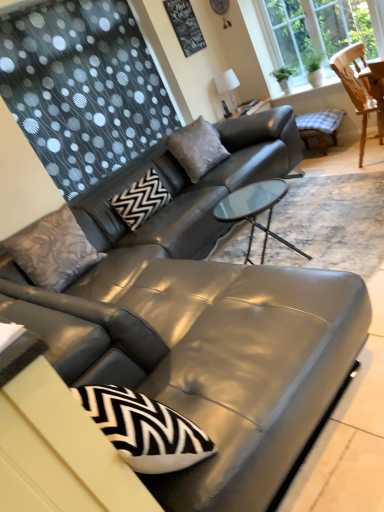
Image resolution: width=384 pixels, height=512 pixels. Describe the element at coordinates (53, 250) in the screenshot. I see `textured gray pillow at left, which is the 3th pillow from right to left` at that location.

What is the approximate width of wooden chair at upper right?

19.75 inches.

This screenshot has height=512, width=384. I want to click on white glass lampshade at upper right, so click(228, 85).

Can transparent glass window at upper right be found inside black zigzag-patterned pillow at center, which appears as the 2th pillow when viewed from the right?

Actually, transparent glass window at upper right is outside black zigzag-patterned pillow at center, which appears as the 2th pillow when viewed from the right.

How many degrees apart are the facing directions of black zigzag-patterned pillow at center, which appears as the 2th pillow when viewed from the right, and transparent glass window at upper right?

They differ by 91.1 degrees in their facing directions.

Can you confirm if black zigzag-patterned pillow at center, which appears as the 2th pillow when viewed from the right, is bigger than transparent glass window at upper right?

No, black zigzag-patterned pillow at center, which appears as the 2th pillow when viewed from the right, is not bigger than transparent glass window at upper right.

From a real-world perspective, relative to transparent glass window at upper right, is black zigzag-patterned pillow at center, the second pillow from the left, vertically above or below?

black zigzag-patterned pillow at center, the second pillow from the left, is below transparent glass window at upper right.

Is black zigzag-patterned pillow at center, the second pillow from the left, a part of textured gray pillow at left, which is the 3th pillow from right to left?

No, black zigzag-patterned pillow at center, the second pillow from the left, is not surrounded by textured gray pillow at left, which is the 3th pillow from right to left.

In the scene shown: Can you confirm if textured gray pillow at left, which is the 3th pillow from right to left, is positioned to the left of black zigzag-patterned pillow at center, which appears as the 2th pillow when viewed from the right?

Correct, you'll find textured gray pillow at left, which is the 3th pillow from right to left, to the left of black zigzag-patterned pillow at center, which appears as the 2th pillow when viewed from the right.

From the image's perspective, who appears lower, textured gray pillow at left, which is the 3th pillow from right to left, or black zigzag-patterned pillow at center, the second pillow from the left?

textured gray pillow at left, which is the 3th pillow from right to left, is shown below in the image.

From a real-world perspective, which object rests below the other?

In real-world perspective, black zigzag-patterned pillow at center, the second pillow from the left, is lower.

Is matte gray cushion at center, which is the third pillow in left-to-right order, beside black zigzag-patterned pillow at center, which appears as the 2th pillow when viewed from the right?

No.

Does matte gray cushion at center, which is the third pillow in left-to-right order, have a larger size compared to black zigzag-patterned pillow at center, which appears as the 2th pillow when viewed from the right?

Indeed, matte gray cushion at center, which is the third pillow in left-to-right order, has a larger size compared to black zigzag-patterned pillow at center, which appears as the 2th pillow when viewed from the right.

Based on the photo, could you tell me if black textured board at upper center is turned towards textured gray pillow at left, the 1th pillow from the left?

No, black textured board at upper center is not oriented towards textured gray pillow at left, the 1th pillow from the left.

Considering the points (188, 22) and (11, 244), which point is in front, point (188, 22) or point (11, 244)?

The point (11, 244) is closer to the camera.

Would you say black textured board at upper center is outside textured gray pillow at left, the 1th pillow from the left?

Absolutely, black textured board at upper center is external to textured gray pillow at left, the 1th pillow from the left.

Can you confirm if black textured board at upper center is wider than matte gray cushion at center, which is the third pillow in left-to-right order?

Incorrect, the width of black textured board at upper center does not surpass that of matte gray cushion at center, which is the third pillow in left-to-right order.

Are black textured board at upper center and matte gray cushion at center, acting as the first pillow starting from the right, located far from each other?

black textured board at upper center is far away from matte gray cushion at center, acting as the first pillow starting from the right.

Which is more to the right, black textured board at upper center or matte gray cushion at center, which is the third pillow in left-to-right order?

From the viewer's perspective, matte gray cushion at center, which is the third pillow in left-to-right order, appears more on the right side.

From the image's perspective, is black textured board at upper center located beneath matte gray cushion at center, which is the third pillow in left-to-right order?

Incorrect, from the image's perspective, black textured board at upper center is higher than matte gray cushion at center, which is the third pillow in left-to-right order.

Is black zigzag-patterned pillow at center, the second pillow from the left, looking in the opposite direction of textured gray pillow at left, which is the 3th pillow from right to left?

No, black zigzag-patterned pillow at center, the second pillow from the left, is not facing away from textured gray pillow at left, which is the 3th pillow from right to left.

Is black zigzag-patterned pillow at center, the second pillow from the left, taller or shorter than textured gray pillow at left, the 1th pillow from the left?

black zigzag-patterned pillow at center, the second pillow from the left, is shorter than textured gray pillow at left, the 1th pillow from the left.

Considering the relative sizes of black zigzag-patterned pillow at center, which appears as the 2th pillow when viewed from the right, and textured gray pillow at left, the 1th pillow from the left, in the image provided, is black zigzag-patterned pillow at center, which appears as the 2th pillow when viewed from the right, wider than textured gray pillow at left, the 1th pillow from the left,?

Yes, black zigzag-patterned pillow at center, which appears as the 2th pillow when viewed from the right, is wider than textured gray pillow at left, the 1th pillow from the left.

Is black zigzag-patterned pillow at center, the second pillow from the left, in contact with textured gray pillow at left, which is the 3th pillow from right to left?

No, black zigzag-patterned pillow at center, the second pillow from the left, is not making contact with textured gray pillow at left, which is the 3th pillow from right to left.

Locate an element on the screen. Image resolution: width=384 pixels, height=512 pixels. bulletin board behind the matte gray cushion at center, acting as the first pillow starting from the right is located at coordinates (185, 26).

Which is correct: matte gray cushion at center, which is the third pillow in left-to-right order, is inside black textured board at upper center, or outside of it?

matte gray cushion at center, which is the third pillow in left-to-right order, is not enclosed by black textured board at upper center.

Considering the points (218, 158) and (171, 21), which point is behind, point (218, 158) or point (171, 21)?

Point (171, 21)

Considering the sizes of matte gray cushion at center, which is the third pillow in left-to-right order, and black textured board at upper center in the image, is matte gray cushion at center, which is the third pillow in left-to-right order, wider or thinner than black textured board at upper center?

matte gray cushion at center, which is the third pillow in left-to-right order, is wider than black textured board at upper center.

Locate an element on the screen. This screenshot has width=384, height=512. pillow that is the 1st one when counting forward from the transparent glass window at upper right is located at coordinates (141, 200).

The height and width of the screenshot is (512, 384). Identify the location of pillow on the left of the black zigzag-patterned pillow at center, the second pillow from the left. click(x=53, y=250).

Which object lies further to the anchor point transparent glass window at upper right, black zigzag-patterned pillow at center, which appears as the 2th pillow when viewed from the right, or textured gray pillow at left, which is the 3th pillow from right to left?

textured gray pillow at left, which is the 3th pillow from right to left, lies further to transparent glass window at upper right than the other object.

Looking at the image, which one is located further to matte gray cushion at center, which is the third pillow in left-to-right order, transparent glass window at upper right or white glass lampshade at upper right?

transparent glass window at upper right.

When comparing their distances from matte gray cushion at center, which is the third pillow in left-to-right order, does black textured board at upper center or textured gray pillow at left, the 1th pillow from the left, seem closer?

black textured board at upper center.

From the image, which object appears to be farther from matte gray cushion at center, which is the third pillow in left-to-right order, white glass lampshade at upper right or black zigzag-patterned pillow at center, the second pillow from the left?

white glass lampshade at upper right lies further to matte gray cushion at center, which is the third pillow in left-to-right order, than the other object.

From the image, which object appears to be farther from textured gray pillow at left, the 1th pillow from the left, matte gray cushion at center, which is the third pillow in left-to-right order, or black textured board at upper center?

Based on the image, black textured board at upper center appears to be further to textured gray pillow at left, the 1th pillow from the left.

In the scene shown: Which object lies further to the anchor point transparent glass window at upper right, wooden chair at upper right or textured gray pillow at left, which is the 3th pillow from right to left?

textured gray pillow at left, which is the 3th pillow from right to left, is positioned further to the anchor transparent glass window at upper right.

From the image, which object appears to be nearer to matte gray cushion at center, acting as the first pillow starting from the right, transparent glass window at upper right or wooden chair at upper right?

The object closer to matte gray cushion at center, acting as the first pillow starting from the right, is wooden chair at upper right.

Looking at the image, which one is located closer to matte gray cushion at center, acting as the first pillow starting from the right, wooden chair at upper right or black zigzag-patterned pillow at center, which appears as the 2th pillow when viewed from the right?

Among the two, black zigzag-patterned pillow at center, which appears as the 2th pillow when viewed from the right, is located nearer to matte gray cushion at center, acting as the first pillow starting from the right.

Image resolution: width=384 pixels, height=512 pixels. Identify the location of pillow between black textured board at upper center and wooden chair at upper right from left to right. (196, 148).

Where is `pillow between black zigzag-patterned pillow at center, which appears as the 2th pillow when viewed from the right, and wooden chair at upper right, in the horizontal direction`? Image resolution: width=384 pixels, height=512 pixels. pillow between black zigzag-patterned pillow at center, which appears as the 2th pillow when viewed from the right, and wooden chair at upper right, in the horizontal direction is located at coordinates (196, 148).

Where is `pillow between transparent glass window at upper right and black zigzag-patterned pillow at center, the second pillow from the left, vertically`? Image resolution: width=384 pixels, height=512 pixels. pillow between transparent glass window at upper right and black zigzag-patterned pillow at center, the second pillow from the left, vertically is located at coordinates (196, 148).

Identify the location of lamp between textured gray pillow at left, the 1th pillow from the left, and wooden chair at upper right. (228, 85).